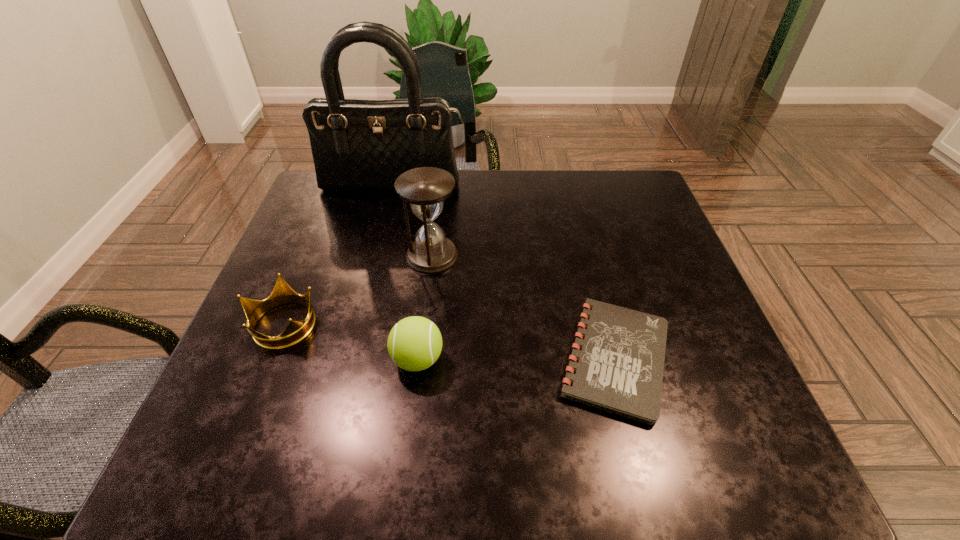
Identify the location of the farthest object. Image resolution: width=960 pixels, height=540 pixels. (357, 145).

Locate an element on the screen. The height and width of the screenshot is (540, 960). the tallest object is located at coordinates (357, 145).

Image resolution: width=960 pixels, height=540 pixels. In order to click on hourglass in this screenshot , I will do `click(425, 189)`.

This screenshot has width=960, height=540. Identify the location of the second farthest object. (425, 189).

I want to click on tennis ball, so click(x=414, y=344).

Where is `crown`? This screenshot has height=540, width=960. crown is located at coordinates (296, 331).

Where is `notebook`? The image size is (960, 540). notebook is located at coordinates (617, 363).

In order to click on the rightmost object in this screenshot , I will do `click(617, 363)`.

This screenshot has height=540, width=960. In order to click on vacant space located 0.370m with an open clasp on the front of the handbag in this screenshot , I will do `click(368, 291)`.

I want to click on free location located 0.270m on the left of the hourglass, so click(294, 256).